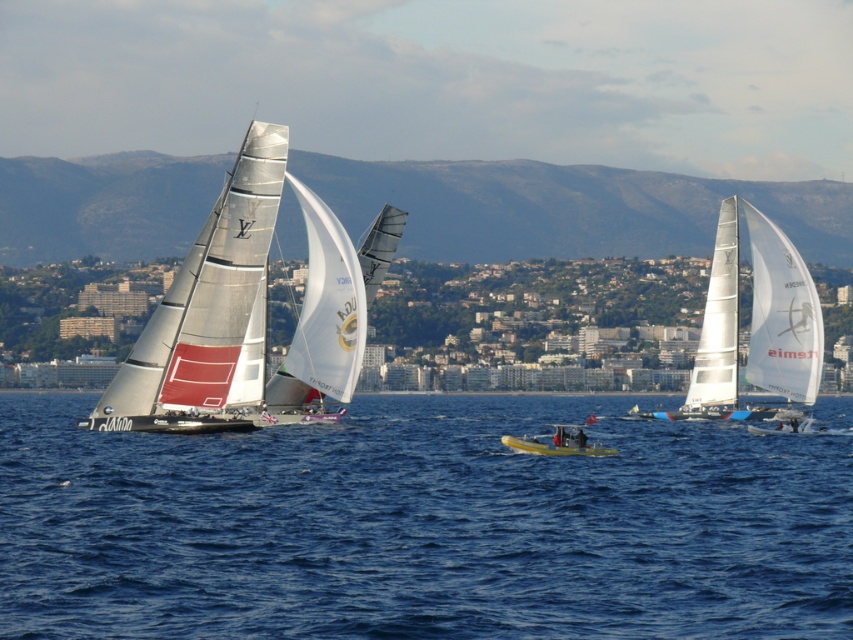
You are a photographer positioned on the shore observing the silver metallic sailboat at left and the yellow plastic kayak at center. Which object would appear closer to you in the photo?

The silver metallic sailboat at left appears closer because it is positioned in front of the yellow plastic kayak at center.

You are a photographer trying to capture the white matte sailboat at right and the yellow plastic kayak at center in a single shot. Given that your camera has a fixed focal length, which object should you position closer to the center of the frame to ensure both are fully visible?

The white matte sailboat at right is wider than the yellow plastic kayak at center. To ensure both are fully visible in the frame, you should position the wider white matte sailboat at right closer to the center of the frame.

You are a spectator standing on the dock watching the white matte sailboat at right and the yellow plastic kayak at center. Which boat appears closer to you?

The white matte sailboat at right appears closer because it is further to the viewer than the yellow plastic kayak at center.